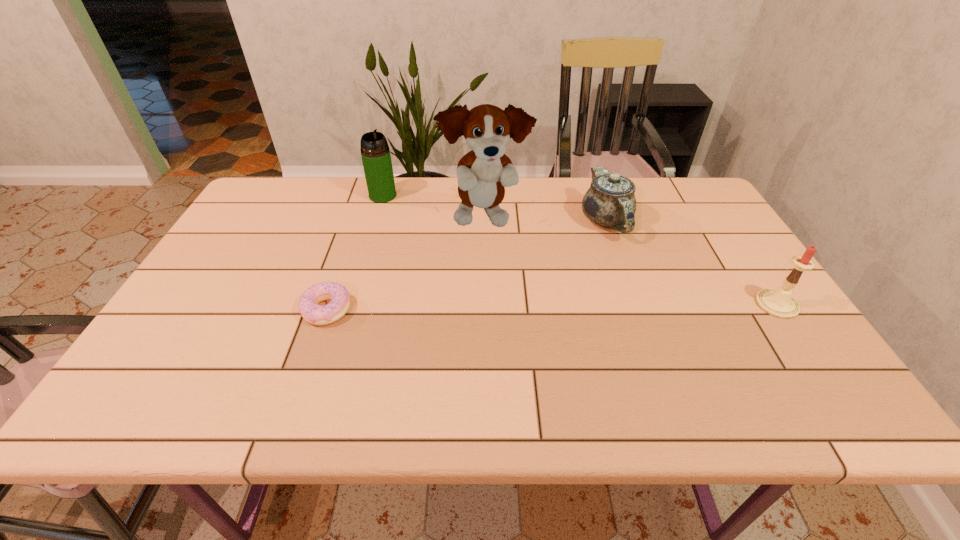
Where is `chinaware present at the far edge`? chinaware present at the far edge is located at coordinates (610, 202).

Locate an element on the screen. object that is at the right edge is located at coordinates tap(779, 303).

Find the location of a particular element. This screenshot has height=540, width=960. free spot at the far edge of the desktop is located at coordinates (642, 200).

Locate an element on the screen. free region at the near edge of the desktop is located at coordinates (416, 355).

Image resolution: width=960 pixels, height=540 pixels. In order to click on vacant space at the left edge of the desktop in this screenshot , I will do `click(176, 316)`.

In the image, there is a desktop. Identify the location of vacant region at the right edge. (718, 246).

The height and width of the screenshot is (540, 960). In the image, there is a desktop. Find the location of `vacant space at the near left corner`. vacant space at the near left corner is located at coordinates (152, 352).

This screenshot has height=540, width=960. I want to click on free location at the far right corner, so click(x=672, y=178).

This screenshot has width=960, height=540. In the image, there is a desktop. In order to click on vacant space at the near right corner in this screenshot , I will do `click(821, 364)`.

Identify the location of empty space between the doughnut and the rightmost object. The height and width of the screenshot is (540, 960). (552, 307).